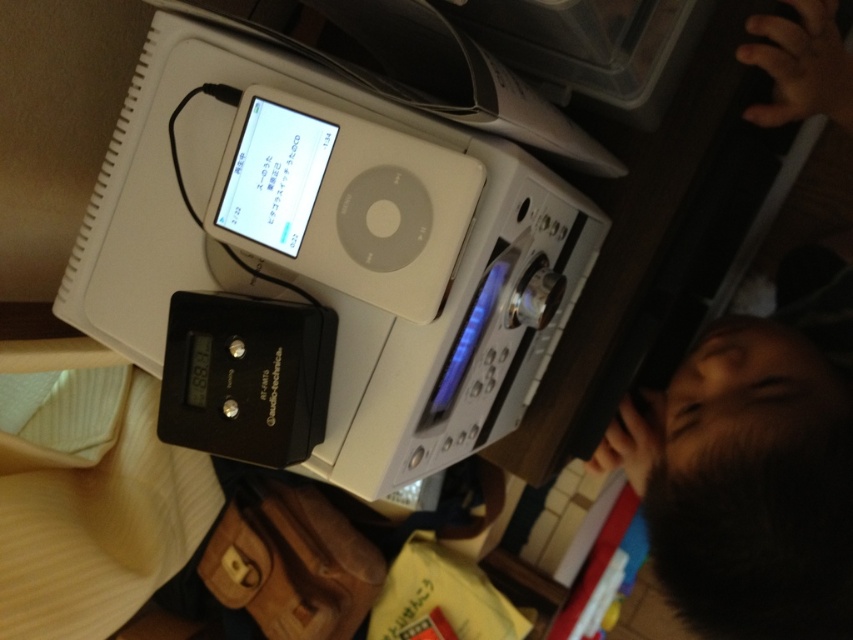
Can you confirm if white matte ipod at upper center is positioned to the right of black plastic ipod at center?

Correct, you'll find white matte ipod at upper center to the right of black plastic ipod at center.

Does white matte ipod at upper center appear under black plastic ipod at center?

No.

Is point (245, 237) behind point (206, 301)?

Yes.

The height and width of the screenshot is (640, 853). What are the coordinates of `white matte ipod at upper center` in the screenshot? It's located at (343, 202).

In the scene shown: Can you confirm if black hair at upper right is smaller than white matte ipod at upper center?

Actually, black hair at upper right might be larger than white matte ipod at upper center.

Does black hair at upper right appear under white matte ipod at upper center?

Correct, black hair at upper right is located below white matte ipod at upper center.

Describe the element at coordinates (746, 483) in the screenshot. I see `black hair at upper right` at that location.

Find the location of a particular element. This screenshot has width=853, height=640. black hair at upper right is located at coordinates (746, 483).

Which of these two, white plastic ipod at upper center or black plastic ipod at center, stands shorter?

black plastic ipod at center

The width and height of the screenshot is (853, 640). Describe the element at coordinates (321, 264) in the screenshot. I see `white plastic ipod at upper center` at that location.

Image resolution: width=853 pixels, height=640 pixels. Find the location of `white plastic ipod at upper center`. white plastic ipod at upper center is located at coordinates (321, 264).